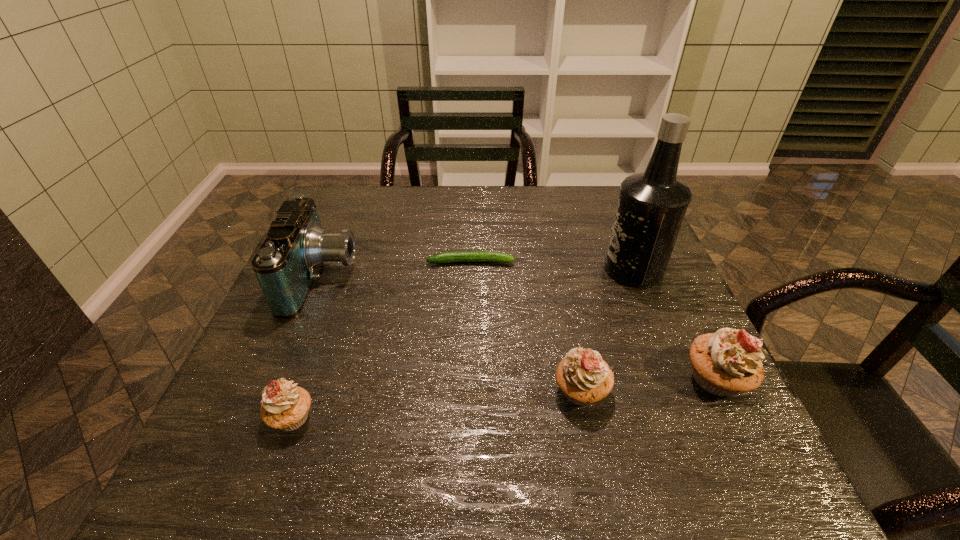
Where is `the leftmost cupcake`? This screenshot has height=540, width=960. the leftmost cupcake is located at coordinates (285, 406).

Locate an element on the screen. the second shortest object is located at coordinates (285, 406).

Find the location of `the third object from right to left`. the third object from right to left is located at coordinates (583, 376).

At what (x,y) coordinates should I click in order to perform the action: click on the second cupcake from left to right. Please return your answer as a coordinate pair (x, y). This screenshot has width=960, height=540. Looking at the image, I should click on (583, 376).

Identify the location of the rightmost cupcake. Image resolution: width=960 pixels, height=540 pixels. (725, 363).

Locate an element on the screen. This screenshot has height=540, width=960. camcorder is located at coordinates (286, 265).

This screenshot has height=540, width=960. In order to click on the fourth object from right to left in this screenshot , I will do `click(453, 256)`.

Where is `zucchini`? The image size is (960, 540). zucchini is located at coordinates (453, 256).

The image size is (960, 540). In order to click on liquor in this screenshot , I will do `click(651, 207)`.

Locate an element on the screen. free point located on the right of the leftmost cupcake is located at coordinates (431, 418).